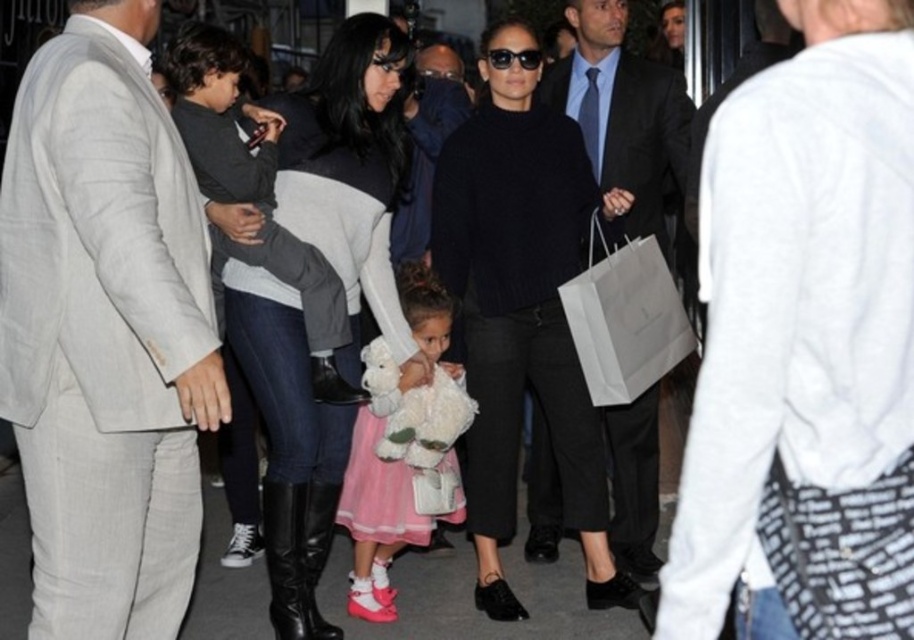
Question: Which object is farther from the camera taking this photo?

Choices:
 (A) pink satin dress at center
 (B) light beige linen suit at left
 (C) dark gray sweater at center
 (D) white cotton shirt at upper right

Answer: (C)

Question: Can you confirm if light beige linen suit at left is bigger than pink satin dress at center?

Choices:
 (A) no
 (B) yes

Answer: (B)

Question: Is dark gray sweater at center behind pink satin dress at center?

Choices:
 (A) no
 (B) yes

Answer: (B)

Question: From the image, what is the correct spatial relationship of light beige linen suit at left in relation to pink satin dress at center?

Choices:
 (A) right
 (B) left

Answer: (B)

Question: Which point appears closest to the camera in this image?

Choices:
 (A) (744, 448)
 (B) (514, 529)
 (C) (369, 579)

Answer: (A)

Question: Estimate the real-world distances between objects in this image. Which object is farther from the light beige linen suit at left?

Choices:
 (A) dark gray sweater at center
 (B) black wool sweater at center

Answer: (B)